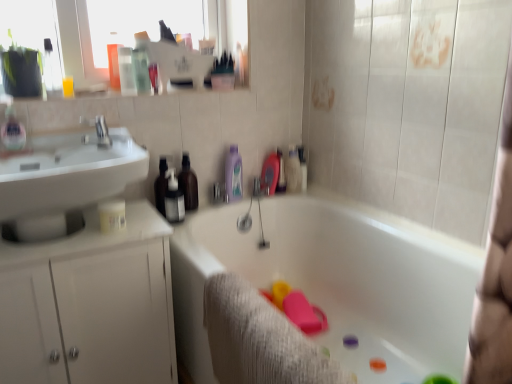
Question: Which is correct: translucent plastic bottle at center, which ranks as the 2th toiletry in right-to-left order, is inside gray textured bath towel at lower center, or outside of it?

Choices:
 (A) outside
 (B) inside

Answer: (A)

Question: Looking at their shapes, would you say translucent plastic bottle at center, the 2th toiletry in the left-to-right sequence, is wider or thinner than gray textured bath towel at lower center?

Choices:
 (A) wide
 (B) thin

Answer: (B)

Question: Considering the real-world distances, which object is farthest from the white matte bottle at upper center, which ranks as the 3th toiletry in left-to-right order?

Choices:
 (A) silver metallic faucet at upper left
 (B) white glossy cabinet at left
 (C) translucent plastic soap dispenser at left
 (D) translucent plastic bottle at center, the 2th toiletry in the left-to-right sequence
 (E) brown matte bottle at center, marked as the 3th toiletry in a right-to-left arrangement

Answer: (C)

Question: Estimate the real-world distances between objects in this image. Which object is farther from the white glossy bathtub at center?

Choices:
 (A) white matte bottle at upper center, which ranks as the 1th toiletry in right-to-left order
 (B) translucent plastic soap dispenser at left
 (C) white glossy cabinet at left
 (D) gray textured bath towel at lower center
 (E) brown matte bottle at center, which is the 1th toiletry from left to right

Answer: (B)